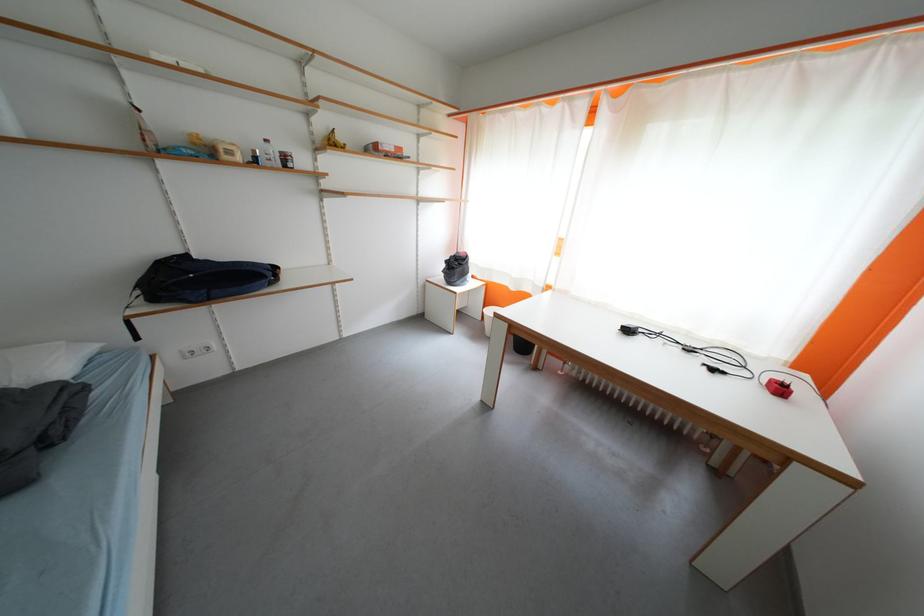
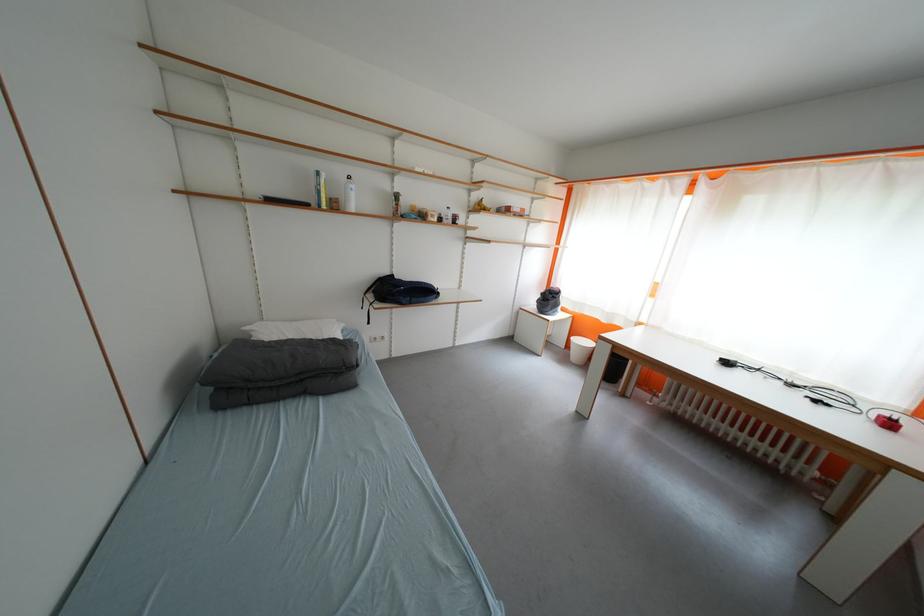
Find the pixel in the second image that matches (x=324, y=171) in the first image.

(476, 225)